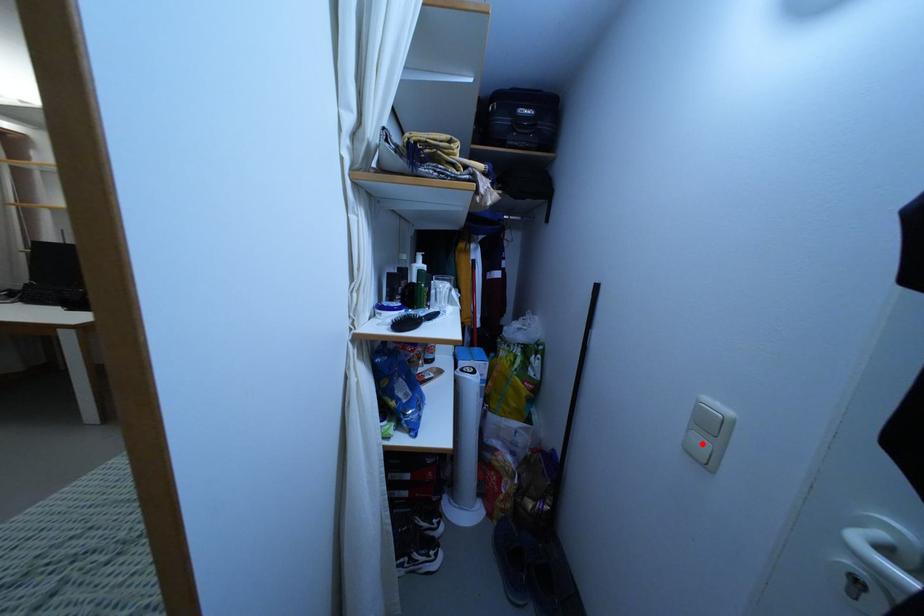
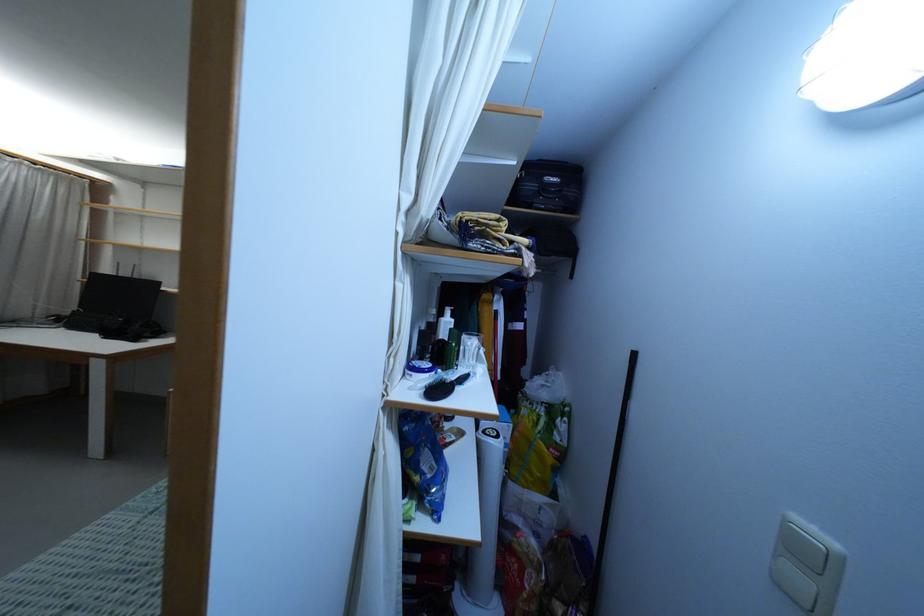
The point at the highlighted location is marked in the first image. Where is the corresponding point in the second image?

(799, 580)